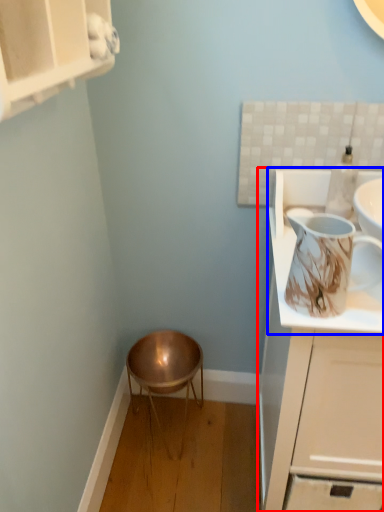
Question: Which of the following is the closest to the observer, cabinetry (highlighted by a red box) or countertop (highlighted by a blue box)?

Choices:
 (A) cabinetry
 (B) countertop

Answer: (A)